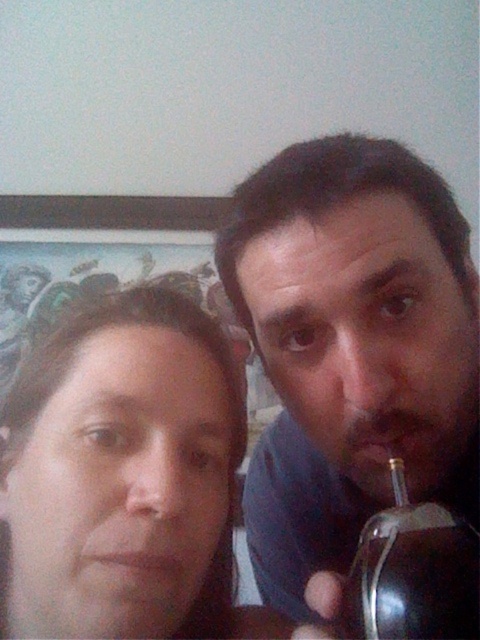
Question: Is matte black hair at center positioned in front of transparent glass bottle at right?

Choices:
 (A) no
 (B) yes

Answer: (A)

Question: Considering the real-world distances, which object is farthest from the matte black cup at right?

Choices:
 (A) transparent glass bottle at right
 (B) matte black hair at center

Answer: (A)

Question: Is matte black hair at center positioned before transparent glass bottle at right?

Choices:
 (A) yes
 (B) no

Answer: (B)

Question: Does matte black cup at right appear on the left side of transparent glass bottle at right?

Choices:
 (A) no
 (B) yes

Answer: (B)

Question: Which of the following is the closest to the observer?

Choices:
 (A) matte black hair at center
 (B) matte black cup at right

Answer: (A)

Question: Which object appears farthest from the camera in this image?

Choices:
 (A) transparent glass bottle at right
 (B) matte black hair at center
 (C) matte black cup at right

Answer: (C)